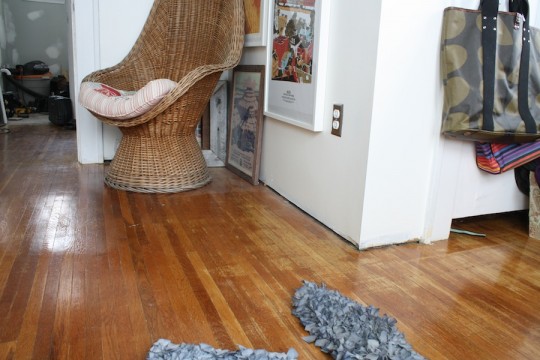
Find the location of a particular element. The width and height of the screenshot is (540, 360). brown straw chair is located at coordinates (182, 38).